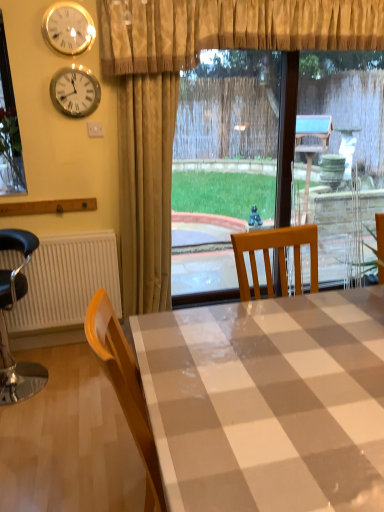
Question: Does white glossy table at center lie behind beige textured curtain at upper center, the first curtain viewed from the top?

Choices:
 (A) yes
 (B) no

Answer: (B)

Question: Can you confirm if white glossy table at center is taller than beige textured curtain at upper center, the first curtain viewed from the top?

Choices:
 (A) no
 (B) yes

Answer: (B)

Question: From a real-world perspective, is white glossy table at center on beige textured curtain at upper center, the first curtain viewed from the top?

Choices:
 (A) yes
 (B) no

Answer: (B)

Question: Does white glossy table at center touch beige textured curtain at upper center, placed as the 2th curtain when sorted from bottom to top?

Choices:
 (A) yes
 (B) no

Answer: (B)

Question: Can you confirm if white glossy table at center is wider than beige textured curtain at upper center, placed as the 2th curtain when sorted from bottom to top?

Choices:
 (A) yes
 (B) no

Answer: (A)

Question: Is gold textured curtain at upper center, which is the second curtain from top to bottom, in front of or behind metallic clock at upper left, the first clock in the bottom-to-top sequence, in the image?

Choices:
 (A) front
 (B) behind

Answer: (A)

Question: In terms of width, does gold textured curtain at upper center, which is the second curtain from top to bottom, look wider or thinner when compared to metallic clock at upper left, the first clock in the bottom-to-top sequence?

Choices:
 (A) thin
 (B) wide

Answer: (B)

Question: In terms of height, does gold textured curtain at upper center, which is the second curtain from top to bottom, look taller or shorter compared to metallic clock at upper left, the first clock in the bottom-to-top sequence?

Choices:
 (A) tall
 (B) short

Answer: (A)

Question: From a real-world perspective, is gold textured curtain at upper center, which is the second curtain from top to bottom, physically located above or below metallic clock at upper left, the first clock in the bottom-to-top sequence?

Choices:
 (A) below
 (B) above

Answer: (A)

Question: Considering the positions of gold textured curtain at upper center, which is the second curtain from top to bottom, and white glossy table at center in the image, is gold textured curtain at upper center, which is the second curtain from top to bottom, wider or thinner than white glossy table at center?

Choices:
 (A) wide
 (B) thin

Answer: (B)

Question: Considering the relative positions of gold textured curtain at upper center, arranged as the first curtain when ordered from the bottom, and white glossy table at center in the image provided, is gold textured curtain at upper center, arranged as the first curtain when ordered from the bottom, to the left or to the right of white glossy table at center?

Choices:
 (A) right
 (B) left

Answer: (B)

Question: From a real-world perspective, is gold textured curtain at upper center, which is the second curtain from top to bottom, above or below white glossy table at center?

Choices:
 (A) below
 (B) above

Answer: (B)

Question: Looking at the image, does gold textured curtain at upper center, arranged as the first curtain when ordered from the bottom, seem bigger or smaller compared to white glossy table at center?

Choices:
 (A) small
 (B) big

Answer: (A)

Question: Does point (14, 233) appear closer or farther from the camera than point (82, 81)?

Choices:
 (A) farther
 (B) closer

Answer: (A)

Question: From the image's perspective, relative to metallic clock at upper left, the first clock in the bottom-to-top sequence, is metallic black chair at left above or below?

Choices:
 (A) above
 (B) below

Answer: (B)